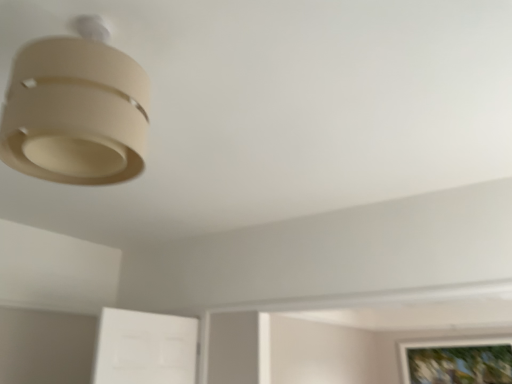
Question: Can you confirm if matte beige lampshade at upper left is shorter than wooden framed picture at lower right?

Choices:
 (A) yes
 (B) no

Answer: (A)

Question: Does matte beige lampshade at upper left touch wooden framed picture at lower right?

Choices:
 (A) yes
 (B) no

Answer: (B)

Question: Is matte beige lampshade at upper left further to the viewer compared to wooden framed picture at lower right?

Choices:
 (A) no
 (B) yes

Answer: (A)

Question: Is matte beige lampshade at upper left taller than wooden framed picture at lower right?

Choices:
 (A) no
 (B) yes

Answer: (A)

Question: From the image's perspective, is matte beige lampshade at upper left over wooden framed picture at lower right?

Choices:
 (A) no
 (B) yes

Answer: (B)

Question: Considering the relative sizes of matte beige lampshade at upper left and wooden framed picture at lower right in the image provided, is matte beige lampshade at upper left wider than wooden framed picture at lower right?

Choices:
 (A) yes
 (B) no

Answer: (A)

Question: Could matte beige lampshade at upper left be considered to be inside wooden framed picture at lower right?

Choices:
 (A) yes
 (B) no

Answer: (B)

Question: Does wooden framed picture at lower right turn towards matte beige lampshade at upper left?

Choices:
 (A) no
 (B) yes

Answer: (B)

Question: Is the position of wooden framed picture at lower right less distant than that of matte beige lampshade at upper left?

Choices:
 (A) no
 (B) yes

Answer: (A)

Question: Is wooden framed picture at lower right positioned with its back to matte beige lampshade at upper left?

Choices:
 (A) yes
 (B) no

Answer: (B)

Question: Is wooden framed picture at lower right smaller than matte beige lampshade at upper left?

Choices:
 (A) no
 (B) yes

Answer: (B)

Question: Is wooden framed picture at lower right not within matte beige lampshade at upper left?

Choices:
 (A) yes
 (B) no

Answer: (A)

Question: From the image's perspective, is matte beige lampshade at upper left positioned above or below wooden framed picture at lower right?

Choices:
 (A) below
 (B) above

Answer: (B)